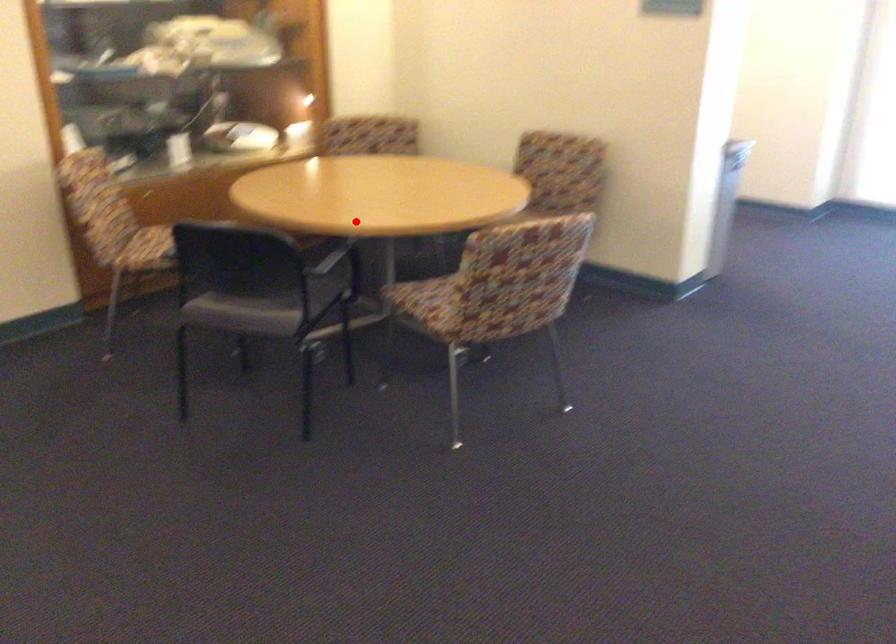
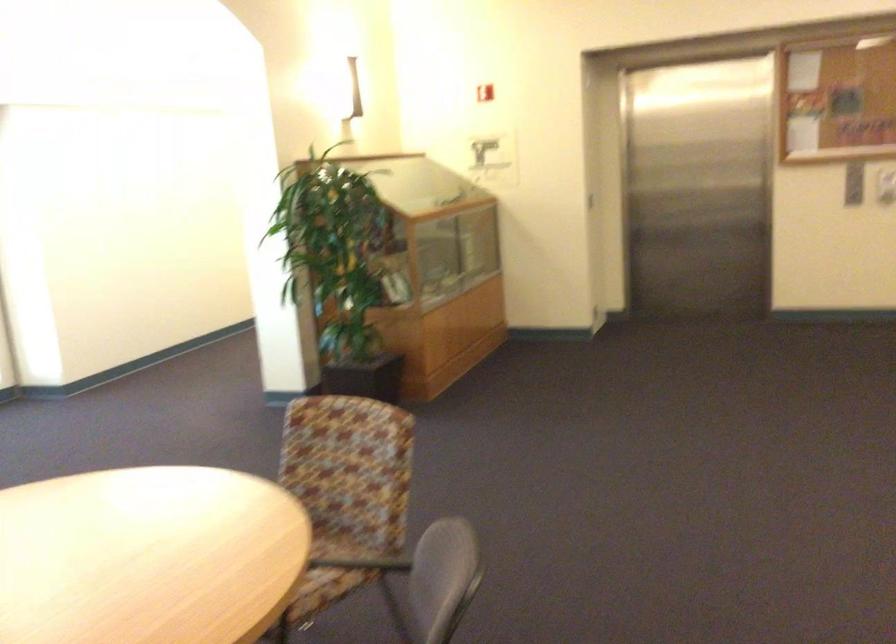
Question: A red point is marked in image1. In image2, is the corresponding 3D point closer to the camera or farther? Reply with the corresponding letter.

Choices:
 (A) The corresponding 3D point is closer.
 (B) The corresponding 3D point is farther.

Answer: (A)